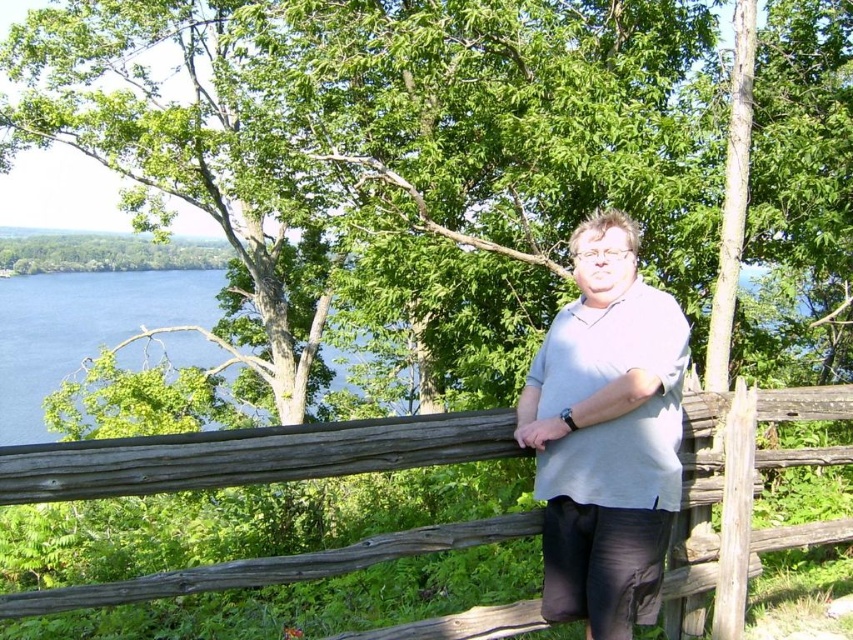
Question: Can you confirm if weathered wood fence at center is positioned to the right of light gray cotton shirt at center?

Choices:
 (A) yes
 (B) no

Answer: (A)

Question: Can you confirm if weathered wood fence at center is wider than blue liquid water at left?

Choices:
 (A) no
 (B) yes

Answer: (A)

Question: Is weathered wood fence at center thinner than blue liquid water at left?

Choices:
 (A) no
 (B) yes

Answer: (B)

Question: Which object is positioned closest to the light gray cotton shirt at center?

Choices:
 (A) blue liquid water at left
 (B) weathered wood fence at center

Answer: (B)

Question: Which is farther from the weathered wood fence at center?

Choices:
 (A) blue liquid water at left
 (B) light gray cotton shirt at center

Answer: (A)

Question: Which of the following is the closest to the observer?

Choices:
 (A) (614, 588)
 (B) (125, 589)
 (C) (76, 276)

Answer: (B)